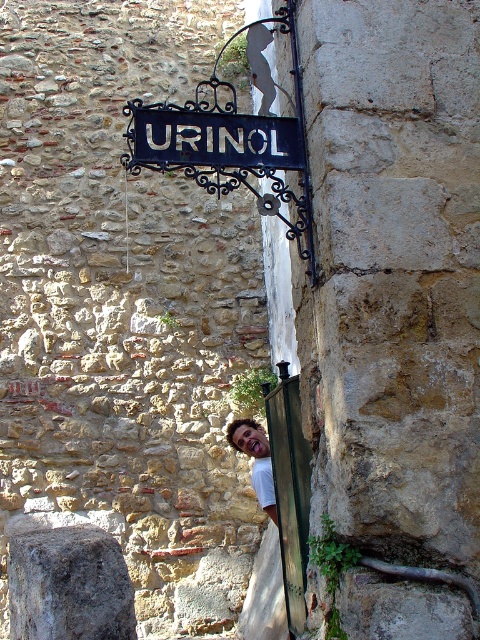
You are an artist planning to sketch this scene. You need to ensure that the black wrought iron sign at upper center and the smooth skin face at lower center are proportionally accurate. Which object should you draw first to maintain the correct spatial relationship between them?

You should draw the black wrought iron sign at upper center first because it might be wider than the smooth skin face at lower center, so starting with the wider object will help establish the correct proportions between them.

You are standing in front of the rustic stone wall and see the black wrought iron sign at upper center and the smooth skin face at lower center. Which object is positioned to the right side of the other?

The smooth skin face at lower center is to the right of the black wrought iron sign at upper center.